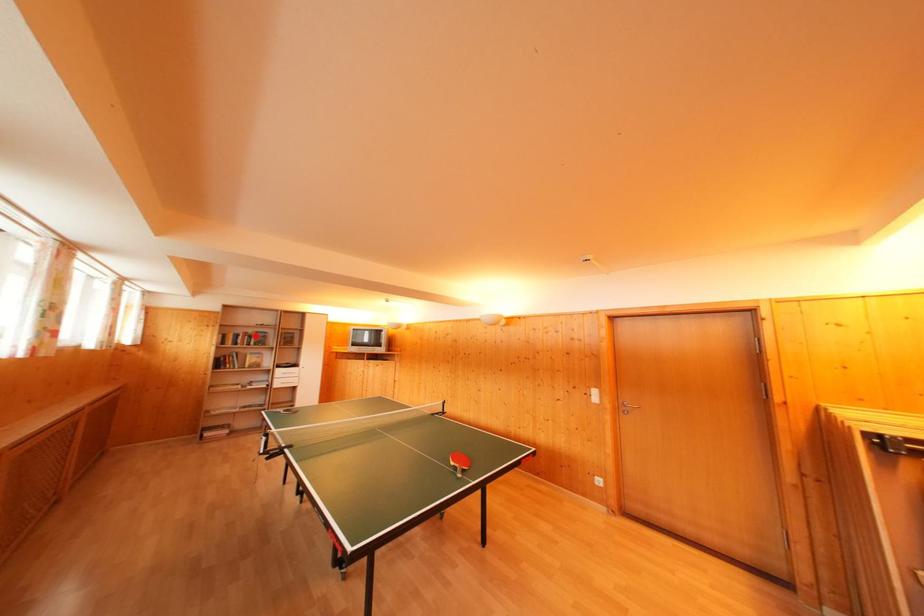
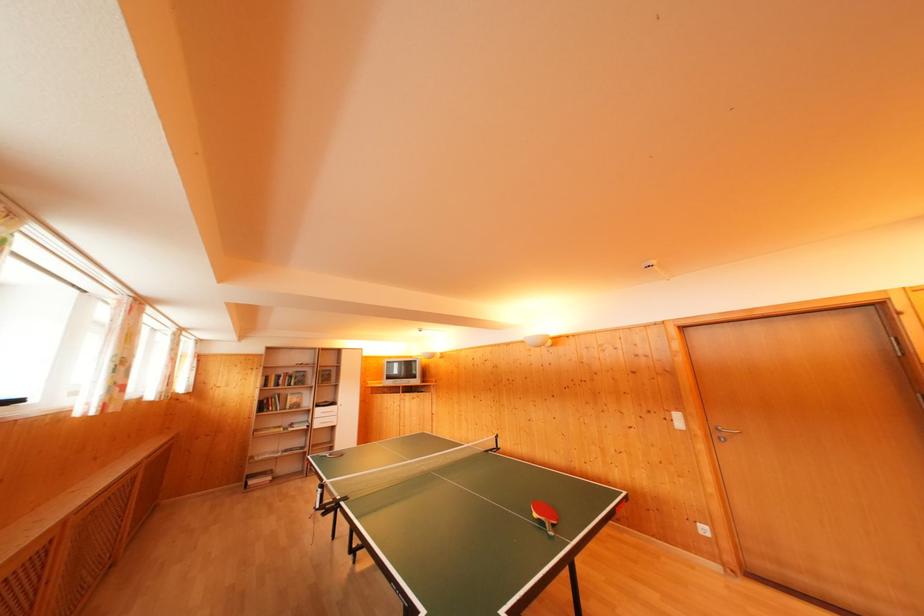
Locate, in the second image, the point that corresponds to the highlighted location in the first image.

(296, 376)